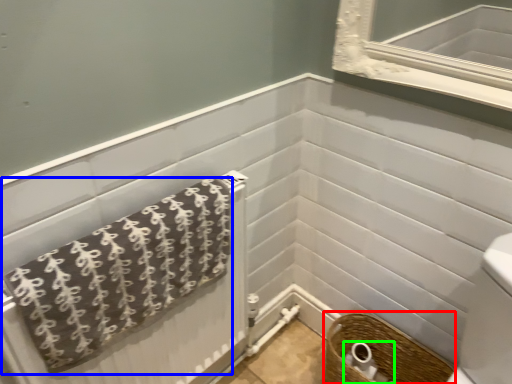
Question: Which object is positioned farthest from basket (highlighted by a red box)? Select from towel (highlighted by a blue box) and toilet paper (highlighted by a green box).

Choices:
 (A) towel
 (B) toilet paper

Answer: (A)